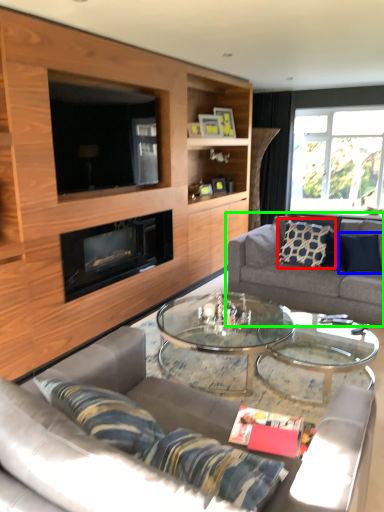
Question: Which is nearer to the pillow (highlighted by a red box)? pillow (highlighted by a blue box) or studio couch (highlighted by a green box).

Choices:
 (A) pillow
 (B) studio couch

Answer: (B)